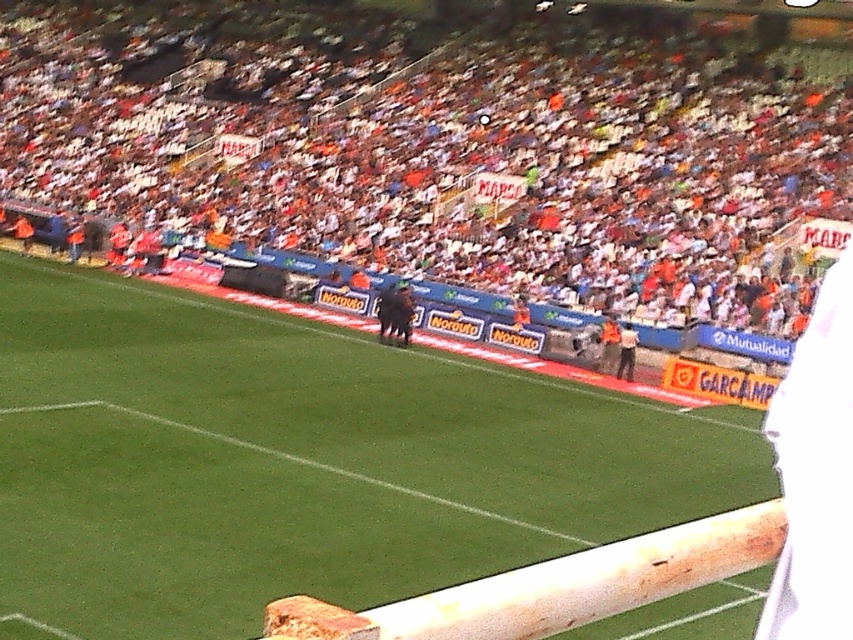
Based on the photo, can you confirm if green grass football field at center is shorter than white fabric shirt at right?

Incorrect, green grass football field at center's height does not fall short of white fabric shirt at right's.

Between green grass football field at center and white fabric shirt at right, which one appears on the right side from the viewer's perspective?

Positioned to the right is white fabric shirt at right.

Is point (109, 424) closer to viewer compared to point (634, 358)?

That is True.

At what (x,y) coordinates should I click in order to perform the action: click on green grass football field at center. Please return your answer as a coordinate pair (x, y). The height and width of the screenshot is (640, 853). Looking at the image, I should click on (302, 461).

Which of these two, orange fabric crowd at upper center or white fabric shirt at right, stands taller?

orange fabric crowd at upper center

Is point (569, 276) farther from camera compared to point (624, 371)?

Yes, it is behind point (624, 371).

In order to click on orange fabric crowd at upper center in this screenshot , I will do `click(447, 141)`.

Which is behind, point (683, 243) or point (517, 410)?

Point (683, 243)

Describe the element at coordinates (447, 141) in the screenshot. The width and height of the screenshot is (853, 640). I see `orange fabric crowd at upper center` at that location.

Is point (396, 116) positioned before point (419, 497)?

That is False.

This screenshot has height=640, width=853. Find the location of `orange fabric crowd at upper center`. orange fabric crowd at upper center is located at coordinates pyautogui.click(x=447, y=141).